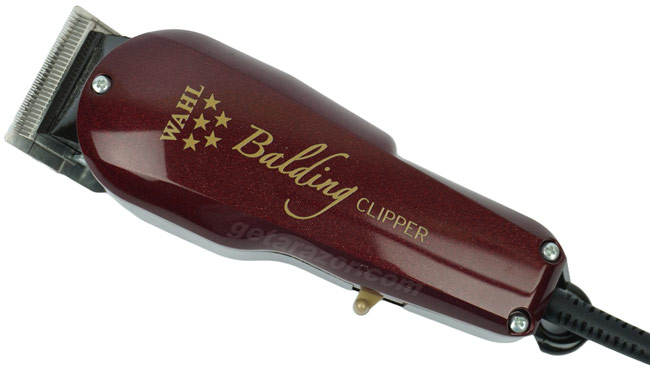
At what (x,y) coordinates should I click in order to perform the action: click on cord. Please return your answer as a coordinate pair (x, y). The image size is (650, 369). Looking at the image, I should click on (606, 327).